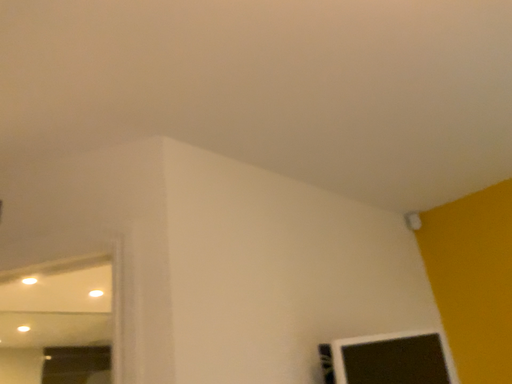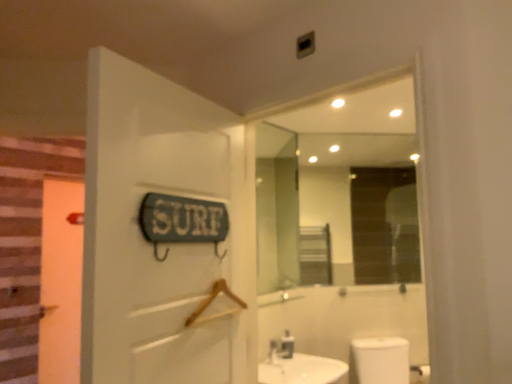
Question: Which way did the camera rotate in the video?

Choices:
 (A) rotated upward
 (B) rotated downward

Answer: (B)